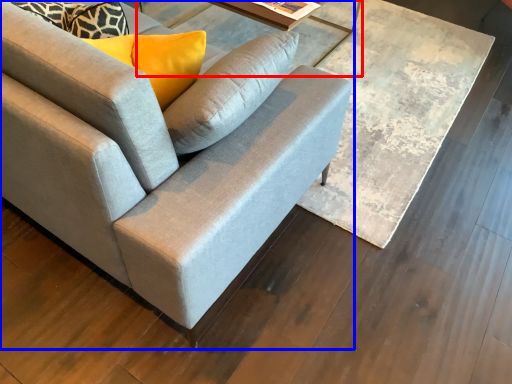
Question: Which point is further to the camera, round table (highlighted by a red box) or studio couch (highlighted by a blue box)?

Choices:
 (A) round table
 (B) studio couch

Answer: (A)